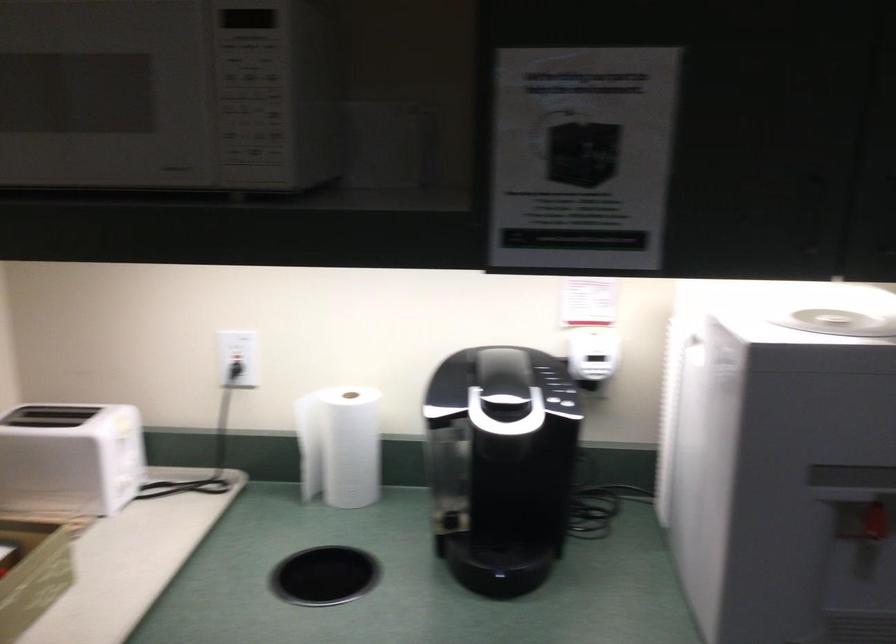
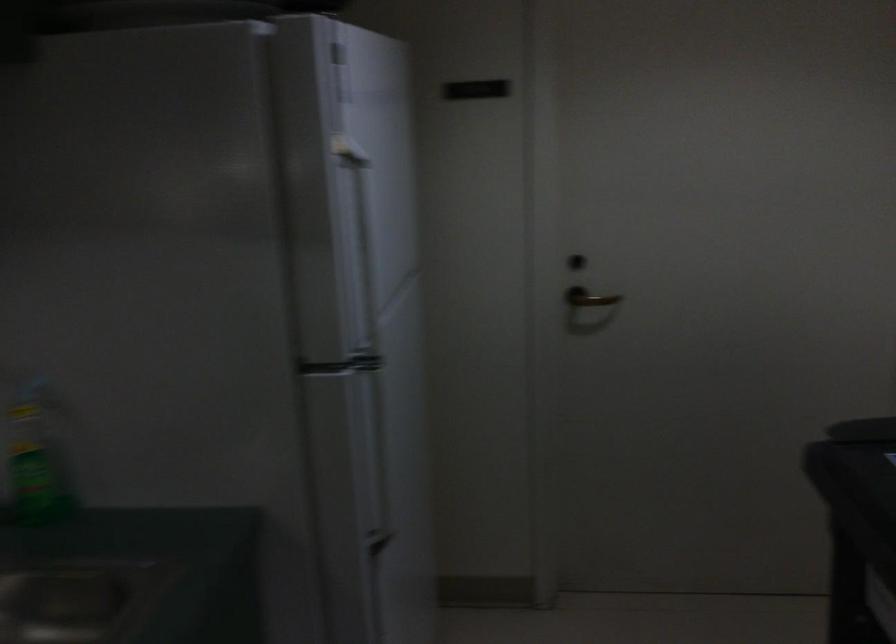
Question: The images are taken continuously from a first-person perspective. In which direction is your viewpoint rotating?

Choices:
 (A) Left
 (B) Right
 (C) Up
 (D) Down

Answer: (B)